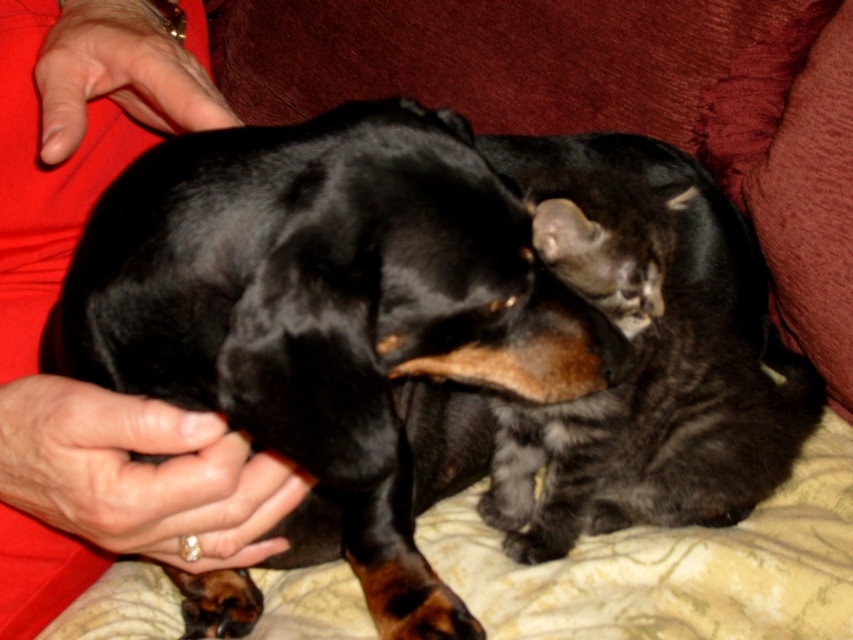
Question: Which is farther from the black shiny dog at center?

Choices:
 (A) smooth red shirt at upper left
 (B) dark gray fur at upper right

Answer: (B)

Question: Considering the relative positions of black shiny dog at center and smooth red shirt at upper left in the image provided, where is black shiny dog at center located with respect to smooth red shirt at upper left?

Choices:
 (A) above
 (B) below

Answer: (B)

Question: Which is farther from the dark gray fur at upper right?

Choices:
 (A) black shiny dog at center
 (B) smooth red shirt at upper left

Answer: (B)

Question: Which point is closer to the camera?

Choices:
 (A) smooth red shirt at upper left
 (B) dark gray fur at upper right
 (C) black shiny dog at center

Answer: (C)

Question: Observing the image, what is the correct spatial positioning of smooth red shirt at upper left in reference to dark gray fur at upper right?

Choices:
 (A) below
 (B) above

Answer: (B)

Question: Does smooth red shirt at upper left have a greater width compared to dark gray fur at upper right?

Choices:
 (A) yes
 (B) no

Answer: (B)